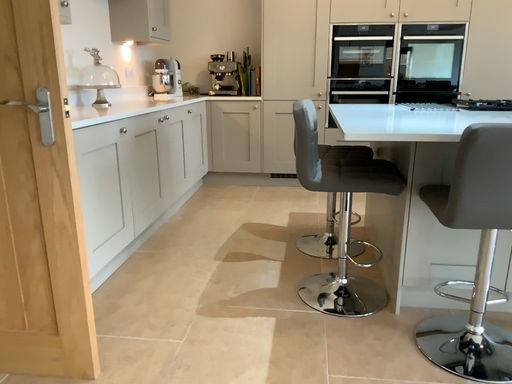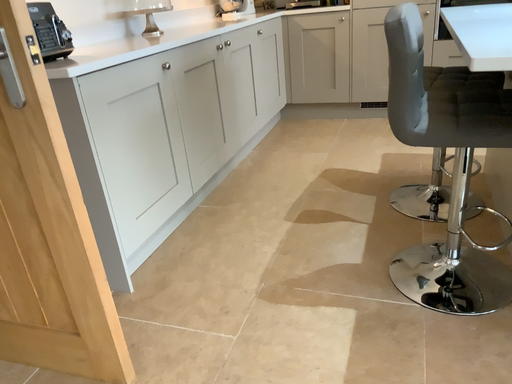
Question: How did the camera likely rotate when shooting the video?

Choices:
 (A) rotated right
 (B) rotated left

Answer: (B)